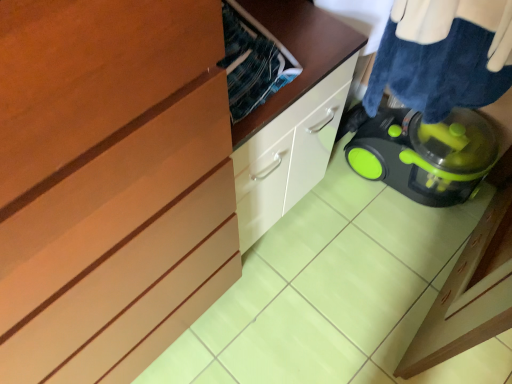
Question: Would you say matte wood cabinet at center is to the left or to the right of green plastic laundry basket at lower right in the picture?

Choices:
 (A) left
 (B) right

Answer: (A)

Question: From a real-world perspective, is matte wood cabinet at center physically located above or below green plastic laundry basket at lower right?

Choices:
 (A) above
 (B) below

Answer: (B)

Question: Is point 105,41 closer or farther from the camera than point 412,59?

Choices:
 (A) closer
 (B) farther

Answer: (A)

Question: Relative to matte wood cabinet at center, is green plastic laundry basket at lower right in front or behind?

Choices:
 (A) behind
 (B) front

Answer: (B)

Question: From the image's perspective, is green plastic laundry basket at lower right located above or below matte wood cabinet at center?

Choices:
 (A) above
 (B) below

Answer: (A)

Question: Would you say green plastic laundry basket at lower right is inside or outside matte wood cabinet at center?

Choices:
 (A) outside
 (B) inside

Answer: (A)

Question: Looking at the image, does green plastic laundry basket at lower right seem bigger or smaller compared to matte wood cabinet at center?

Choices:
 (A) big
 (B) small

Answer: (B)